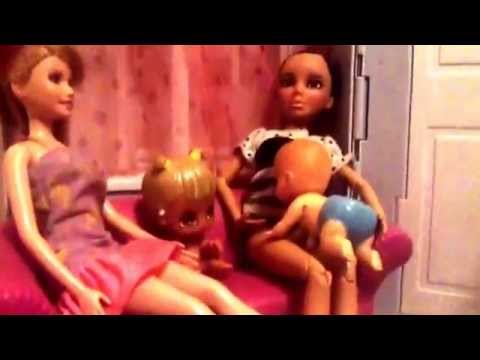
Image resolution: width=480 pixels, height=360 pixels. What are the coordinates of `white toddler doll` in the screenshot? It's located at (173, 214).